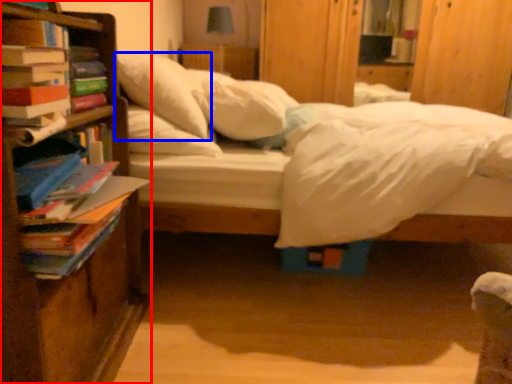
Question: Which object is closer to the camera taking this photo, bookcase (highlighted by a red box) or pillow (highlighted by a blue box)?

Choices:
 (A) bookcase
 (B) pillow

Answer: (A)